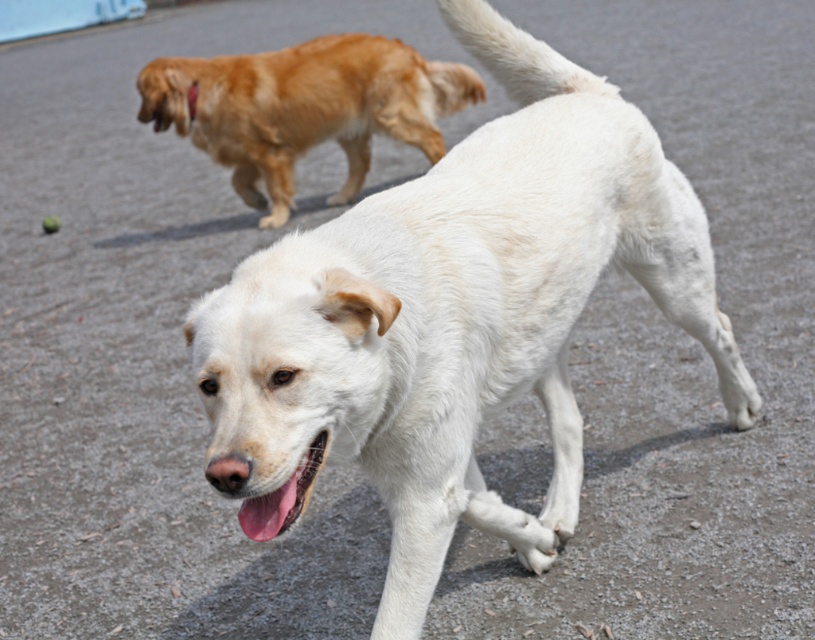
From the picture: You are a photographer trying to capture both the white fur dog at center and the golden fur dog at upper left in a single frame. Given their sizes, which dog would appear bigger in the photo?

The white fur dog at center would appear bigger in the photo because it is larger in size than the golden fur dog at upper left.

You are a photographer trying to capture both the golden fur dog at upper left and the pink glossy tongue at center in a single shot. Based on their sizes in the image, which one would appear larger in the photo?

The golden fur dog at upper left is taller than the pink glossy tongue at center, so it would appear larger in the photo.